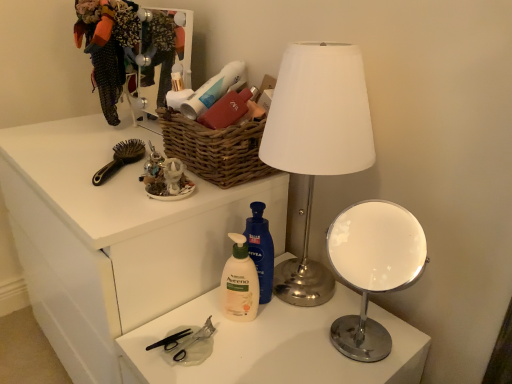
Where is `free point above white plastic table at center (from a real-world perspective)`? free point above white plastic table at center (from a real-world perspective) is located at coordinates (279, 337).